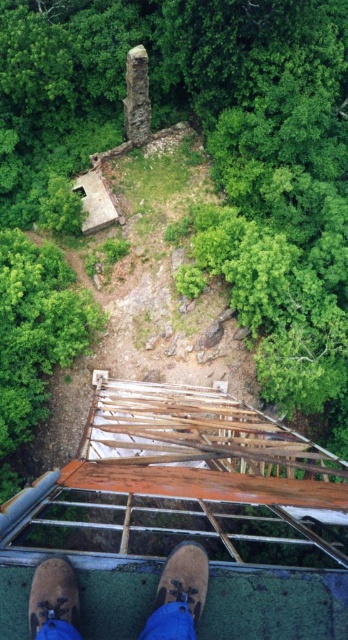
Can you confirm if brown leather shoes at center is positioned below brown suede shoe at lower center?

No.

Who is more forward, (198, 600) or (170, 627)?

Positioned in front is point (170, 627).

You are a GUI agent. You are given a task and a screenshot of the screen. Output one action in this format:
    pyautogui.click(x=<x>, y=<y>)
    Task: Click on the brown leather shoes at center
    This screenshot has width=348, height=640.
    Given the screenshot: What is the action you would take?
    pyautogui.click(x=178, y=595)

Between brown suede shoe at lower center and brown suede shoe at lower left, which one has more height?

With more height is brown suede shoe at lower center.

Is brown suede shoe at lower center bigger than brown suede shoe at lower left?

Yes.

Which is in front, point (186, 628) or point (30, 584)?

Positioned in front is point (186, 628).

The image size is (348, 640). Identify the location of brown suede shoe at lower center. (178, 595).

Describe the element at coordinates (178, 595) in the screenshot. The height and width of the screenshot is (640, 348). I see `brown leather shoes at center` at that location.

From the picture: Is brown leather shoes at center thinner than brown suede shoe at lower left?

Incorrect, brown leather shoes at center's width is not less than brown suede shoe at lower left's.

This screenshot has width=348, height=640. What do you see at coordinates (178, 595) in the screenshot? I see `brown leather shoes at center` at bounding box center [178, 595].

I want to click on brown leather shoes at center, so click(178, 595).